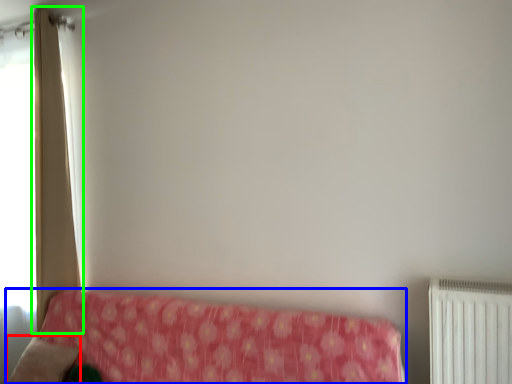
Question: Which object is positioned closest to pillow (highlighted by a red box)? Select from furniture (highlighted by a blue box) and curtain (highlighted by a green box).

Choices:
 (A) furniture
 (B) curtain

Answer: (A)